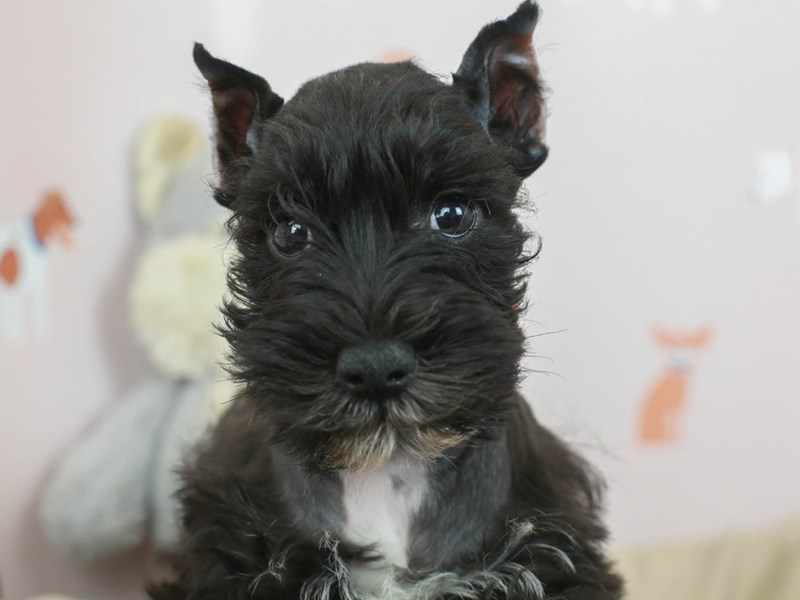
The image size is (800, 600). Identify the location of orange and white animal designs on wall. (672, 386), (34, 238), (754, 180).